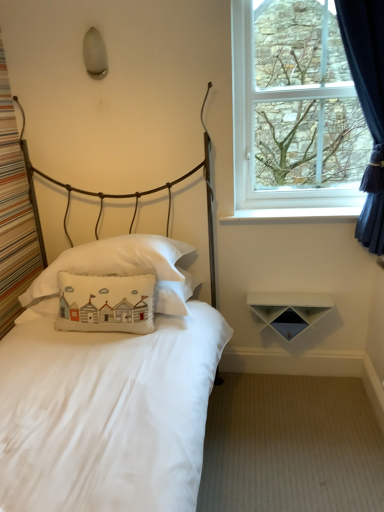
You are a GUI agent. You are given a task and a screenshot of the screen. Output one action in this format:
    pyautogui.click(x=<x>, y=<y>)
    Task: Click on the empty space that is ontop of white painted wood at upper right (from a real-world perspective)
    
    Given the screenshot: What is the action you would take?
    pyautogui.click(x=309, y=208)